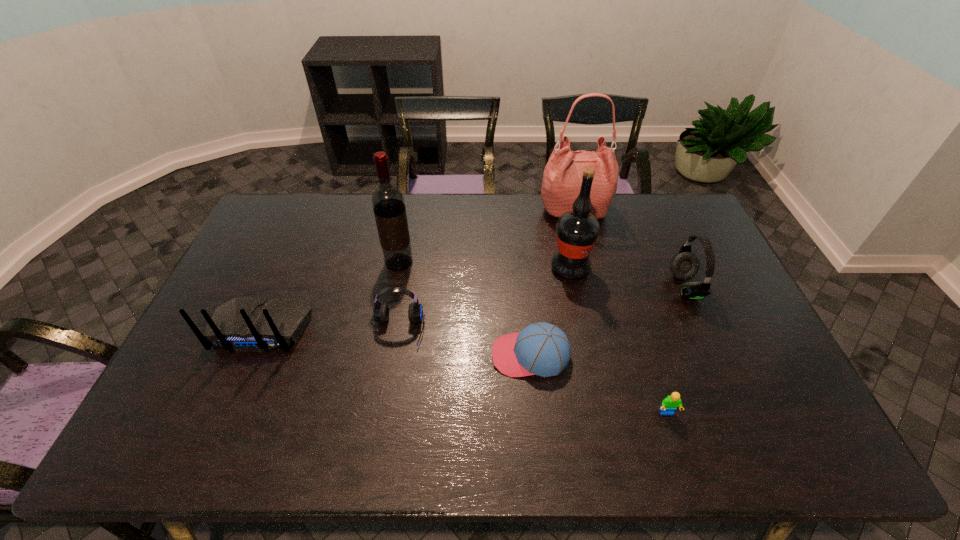
Where is `handbag`? handbag is located at coordinates (562, 178).

What are the coordinates of `the left wine bottle` in the screenshot? It's located at (388, 203).

The height and width of the screenshot is (540, 960). What are the coordinates of `the right wine bottle` in the screenshot? It's located at (577, 231).

Locate an element on the screen. router is located at coordinates (244, 323).

The width and height of the screenshot is (960, 540). What are the coordinates of `the farther headset` in the screenshot? It's located at (684, 265).

Identify the location of the taller headset. This screenshot has height=540, width=960. (684, 265).

What are the coordinates of `the left headset` in the screenshot? It's located at pos(381,310).

Locate an element on the screen. the nearer headset is located at coordinates (381, 310).

Find the location of a particular element. baseball cap is located at coordinates (542, 349).

Find the location of a particular element. The width and height of the screenshot is (960, 540). the shortest object is located at coordinates (670, 403).